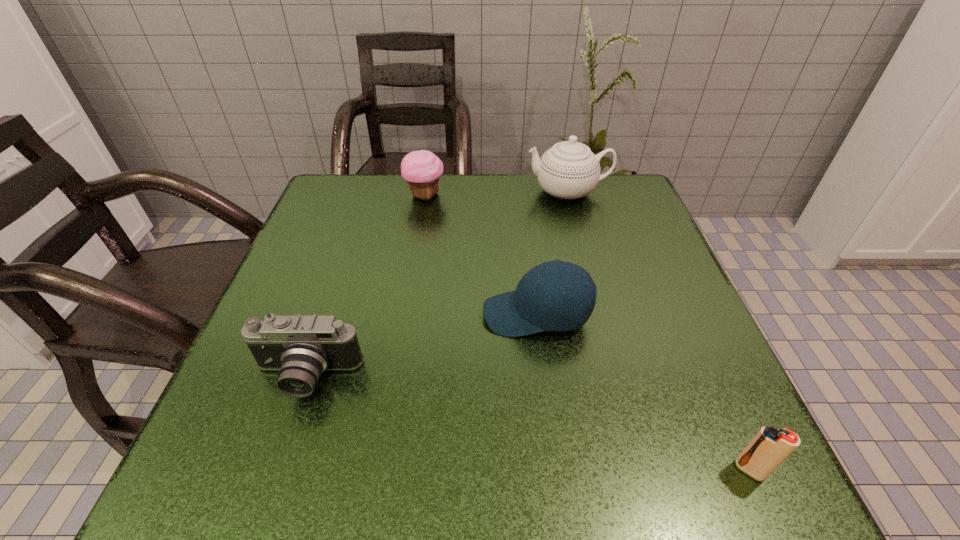
The image size is (960, 540). I want to click on free space that satisfies the following two spatial constraints: 1. on the front-facing side of the third nearest object; 2. on the front-facing side of the camera, so click(x=545, y=377).

Where is `blank space that satisfies the following two spatial constraints: 1. on the spout of the tallest object; 2. on the front-facing side of the camera`? The width and height of the screenshot is (960, 540). blank space that satisfies the following two spatial constraints: 1. on the spout of the tallest object; 2. on the front-facing side of the camera is located at coordinates (617, 377).